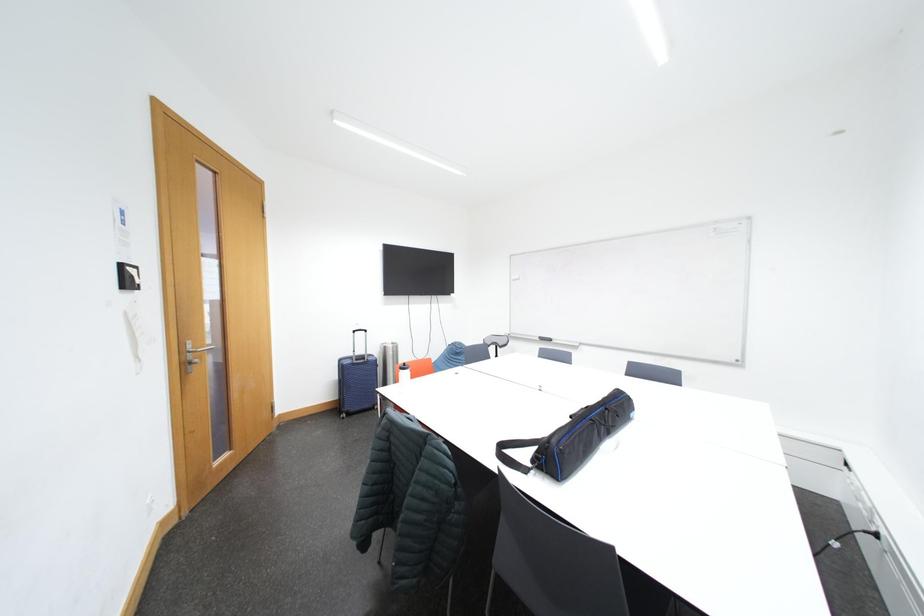
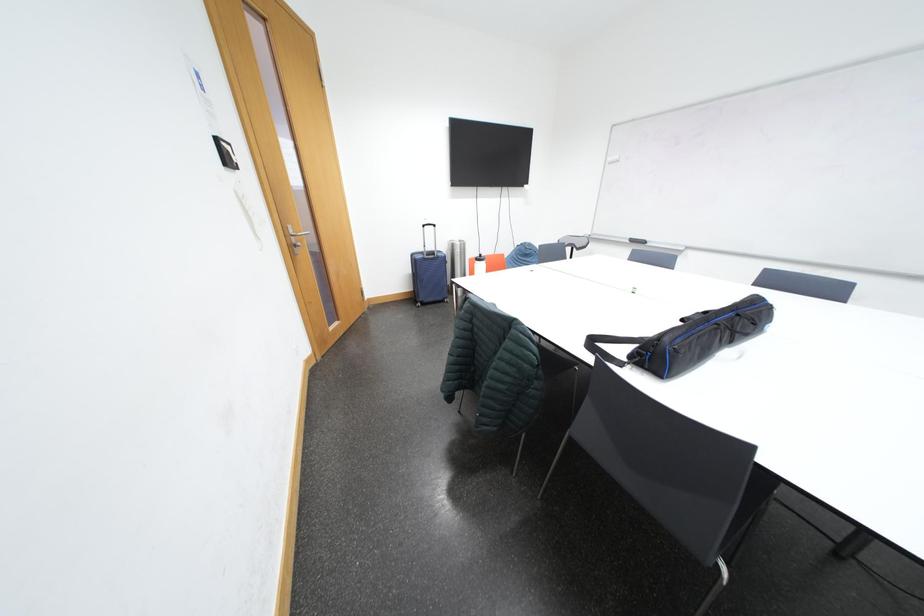
Question: The first image is from the beginning of the video and the second image is from the end. How did the camera likely rotate when shooting the video?

Choices:
 (A) Left
 (B) Right
 (C) Up
 (D) Down

Answer: (D)